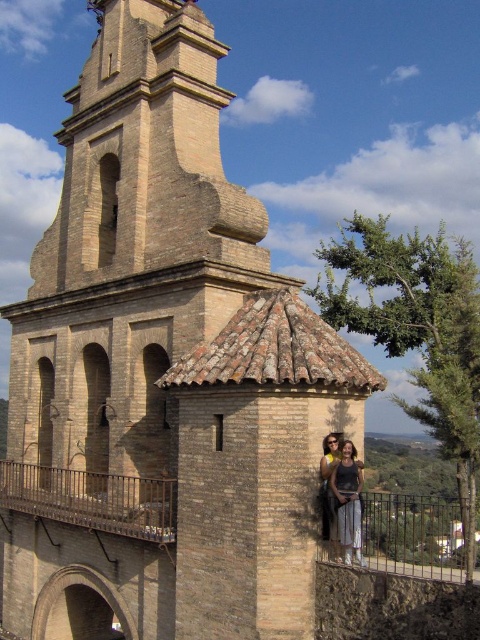
Which is behind, point (110, 506) or point (348, 538)?

The point (110, 506) is more distant.

Which is above, rustic metal railing at center or matte black dress at center?

Positioned higher is matte black dress at center.

At what (x,y) coordinates should I click in order to perform the action: click on rustic metal railing at center. Please return your answer as a coordinate pair (x, y). Looking at the image, I should click on (93, 499).